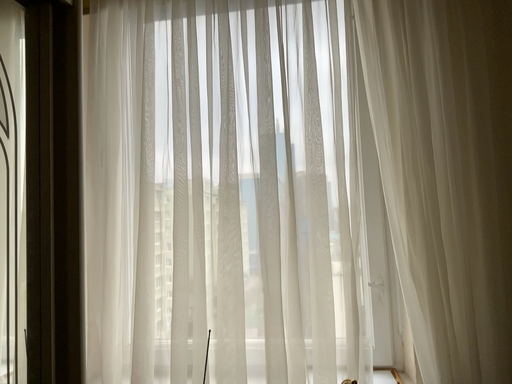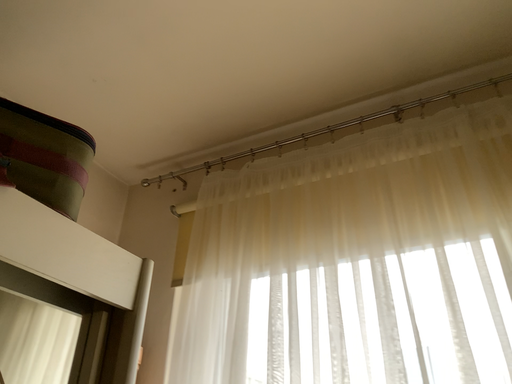
Question: Which way did the camera rotate in the video?

Choices:
 (A) rotated upward
 (B) rotated downward

Answer: (A)